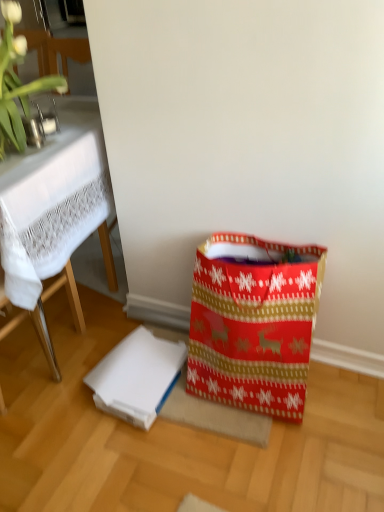
Question: Is white matte cardboard box at lower center spatially inside green leafy plant at upper left, or outside of it?

Choices:
 (A) outside
 (B) inside

Answer: (A)

Question: Considering the positions of white matte cardboard box at lower center and green leafy plant at upper left in the image, is white matte cardboard box at lower center bigger or smaller than green leafy plant at upper left?

Choices:
 (A) small
 (B) big

Answer: (A)

Question: Estimate the real-world distances between objects in this image. Which object is farther from the green leafy plant at upper left?

Choices:
 (A) white lace tablecloth at upper left
 (B) white matte cardboard box at lower center
 (C) red paper shopping bag at lower right

Answer: (C)

Question: Which object is the farthest from the white matte cardboard box at lower center?

Choices:
 (A) red paper shopping bag at lower right
 (B) green leafy plant at upper left
 (C) white lace tablecloth at upper left

Answer: (B)